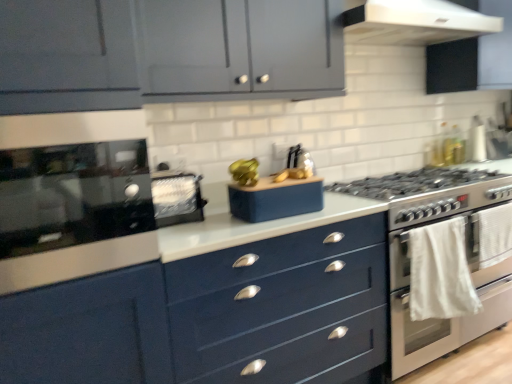
What are the coordinates of `unoccupied area in front of satin black toaster at upper left, which is the 1th appliance in left-to-right order` in the screenshot? It's located at (196, 235).